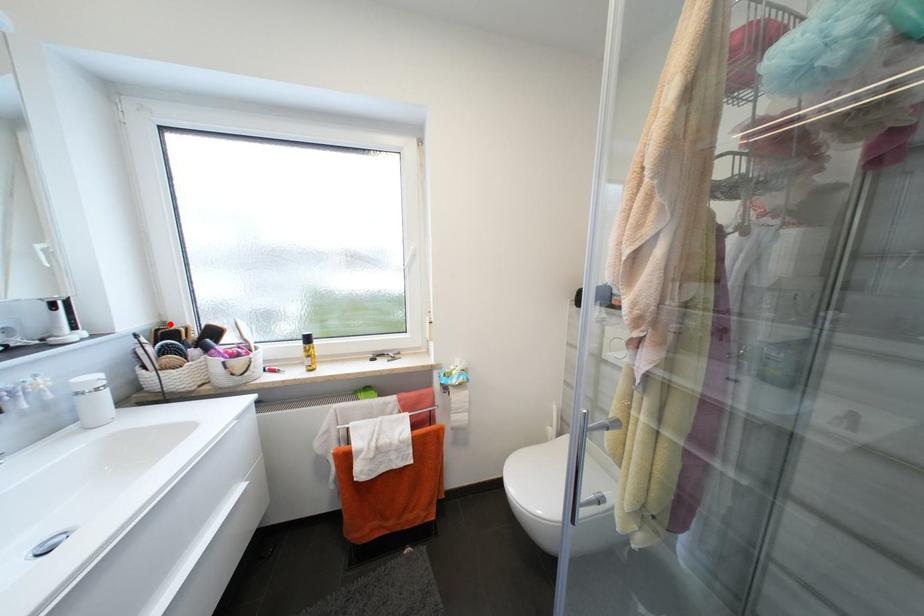
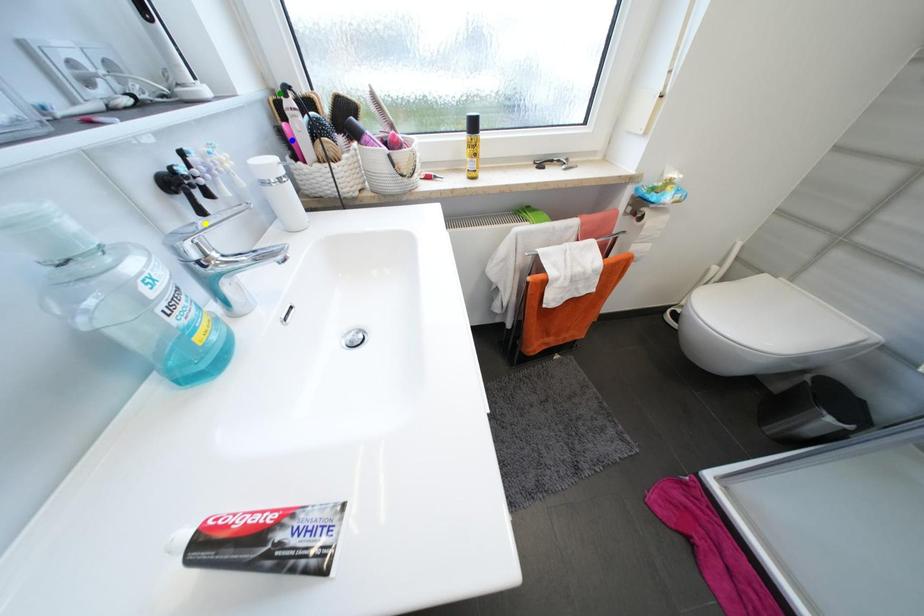
Question: I am providing you with two images of the same scene from different viewpoints. A red point is marked on the first image. You are given multiple points on the second image. Which mark in image 2 goes with the point in image 1?

Choices:
 (A) blue point
 (B) green point
 (C) yellow point

Answer: (B)